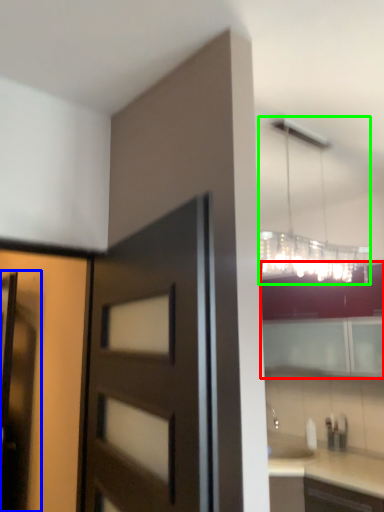
Question: Considering the real-world distances, which object is farthest from cabinetry (highlighted by a red box)? screen door (highlighted by a blue box) or lamp (highlighted by a green box)?

Choices:
 (A) screen door
 (B) lamp

Answer: (A)